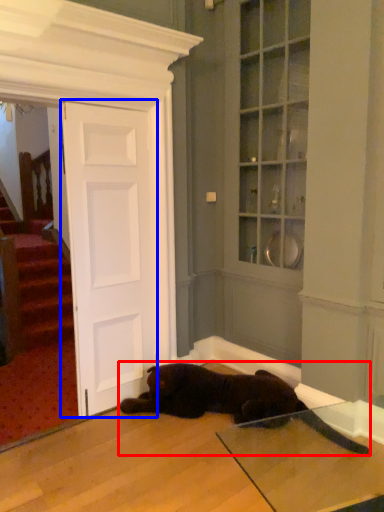
Question: Which object appears farthest to the camera in this image, cat (highlighted by a red box) or door (highlighted by a blue box)?

Choices:
 (A) cat
 (B) door

Answer: (B)